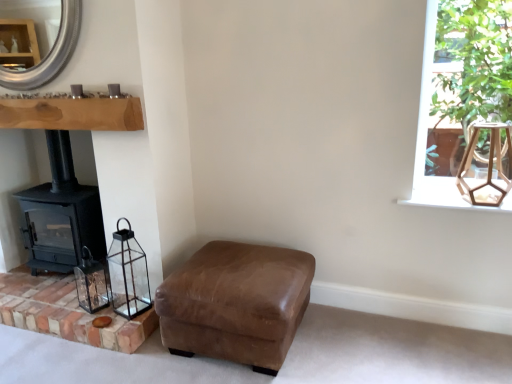
Question: Is brickroughbrickwork at lower left thinner than brown leather ottoman at lower center?

Choices:
 (A) yes
 (B) no

Answer: (A)

Question: Does brickroughbrickwork at lower left have a larger size compared to brown leather ottoman at lower center?

Choices:
 (A) yes
 (B) no

Answer: (B)

Question: Is the depth of brickroughbrickwork at lower left less than that of brown leather ottoman at lower center?

Choices:
 (A) no
 (B) yes

Answer: (A)

Question: Is brickroughbrickwork at lower left positioned beyond the bounds of brown leather ottoman at lower center?

Choices:
 (A) yes
 (B) no

Answer: (A)

Question: Is the depth of brickroughbrickwork at lower left greater than that of brown leather ottoman at lower center?

Choices:
 (A) yes
 (B) no

Answer: (A)

Question: From a real-world perspective, is brickroughbrickwork at lower left physically below brown leather ottoman at lower center?

Choices:
 (A) yes
 (B) no

Answer: (A)

Question: From a real-world perspective, is black matte wood burning stove at left located higher than brickroughbrickwork at lower left?

Choices:
 (A) yes
 (B) no

Answer: (A)

Question: Does black matte wood burning stove at left have a smaller size compared to brickroughbrickwork at lower left?

Choices:
 (A) yes
 (B) no

Answer: (B)

Question: From the image's perspective, does black matte wood burning stove at left appear lower than brickroughbrickwork at lower left?

Choices:
 (A) yes
 (B) no

Answer: (B)

Question: Is black matte wood burning stove at left not within brickroughbrickwork at lower left?

Choices:
 (A) no
 (B) yes

Answer: (B)

Question: Is black matte wood burning stove at left to the left of brickroughbrickwork at lower left from the viewer's perspective?

Choices:
 (A) no
 (B) yes

Answer: (A)

Question: Considering the relative sizes of black matte wood burning stove at left and brickroughbrickwork at lower left in the image provided, is black matte wood burning stove at left wider than brickroughbrickwork at lower left?

Choices:
 (A) yes
 (B) no

Answer: (B)

Question: Considering the relative positions of green leafy plant at upper right and silver metallic mirror at upper left in the image provided, is green leafy plant at upper right to the right of silver metallic mirror at upper left from the viewer's perspective?

Choices:
 (A) yes
 (B) no

Answer: (A)